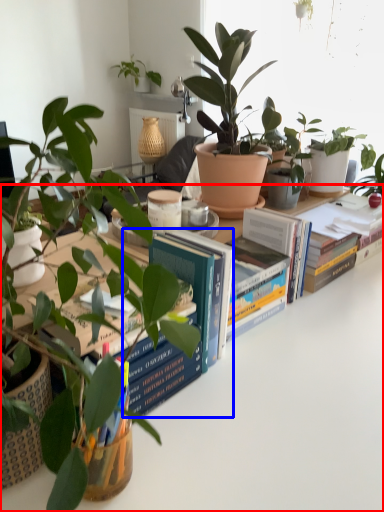
Question: Which object is closer to the camera taking this photo, table (highlighted by a red box) or paperback book (highlighted by a blue box)?

Choices:
 (A) table
 (B) paperback book

Answer: (A)